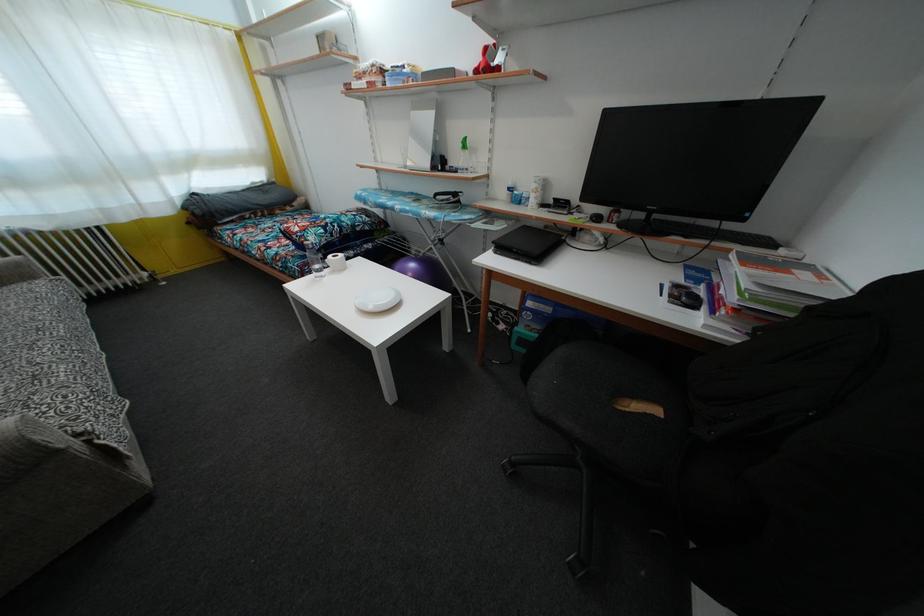
What do you see at coordinates (527, 244) in the screenshot? This screenshot has height=616, width=924. I see `a closed black laptop` at bounding box center [527, 244].